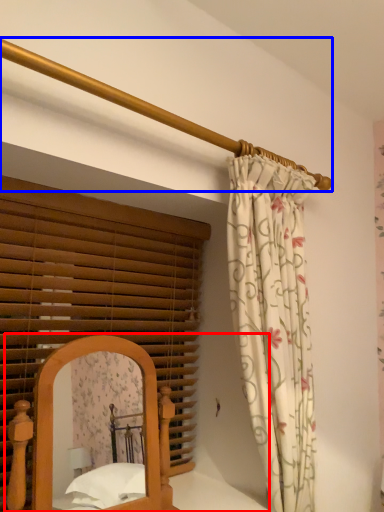
Question: Which point is closer to the camera, bed (highlighted by a red box) or balustrade (highlighted by a blue box)?

Choices:
 (A) bed
 (B) balustrade

Answer: (B)